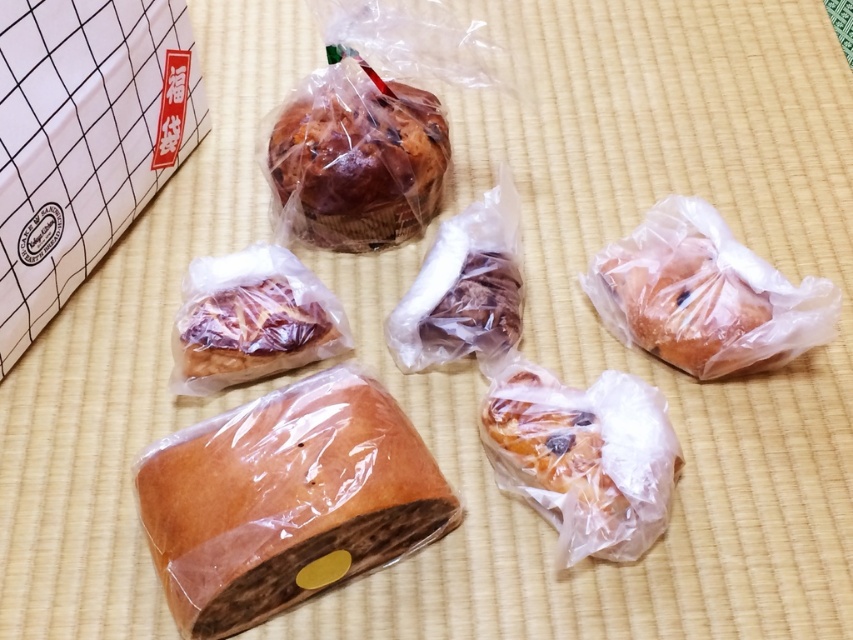
Which is more to the right, golden brown doughnut at center or brown glossy bread at center?

golden brown doughnut at center

Who is higher up, golden brown doughnut at center or brown glossy bread at center?

Positioned higher is brown glossy bread at center.

Which is behind, point (486, 448) or point (264, 296)?

The point (264, 296) is more distant.

Find the location of `golden brown doughnut at center`. golden brown doughnut at center is located at coordinates (584, 458).

Does golden brown crusty loaf at center appear on the right side of golden brown bread at center?

Incorrect, golden brown crusty loaf at center is not on the right side of golden brown bread at center.

Which is more to the right, golden brown crusty loaf at center or golden brown bread at center?

From the viewer's perspective, golden brown bread at center appears more on the right side.

Find the location of a particular element. This screenshot has width=853, height=640. golden brown crusty loaf at center is located at coordinates (285, 499).

Does golden brown bread at center appear on the right side of translucent plastic pastry at center?

Yes, golden brown bread at center is to the right of translucent plastic pastry at center.

Is golden brown bread at center to the left of translucent plastic pastry at center from the viewer's perspective?

No, golden brown bread at center is not to the left of translucent plastic pastry at center.

Which is in front, point (665, 268) or point (486, 304)?

Positioned in front is point (486, 304).

In order to click on golden brown bread at center in this screenshot , I will do `click(680, 304)`.